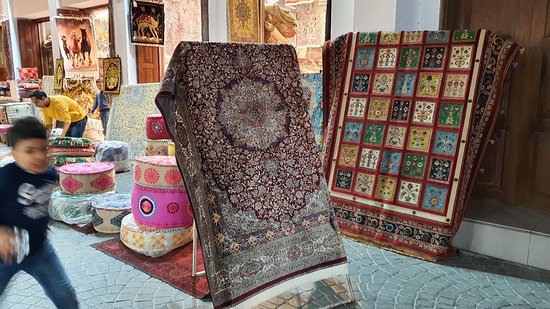
The image size is (550, 309). Identify the location of wooden wall. (531, 162).